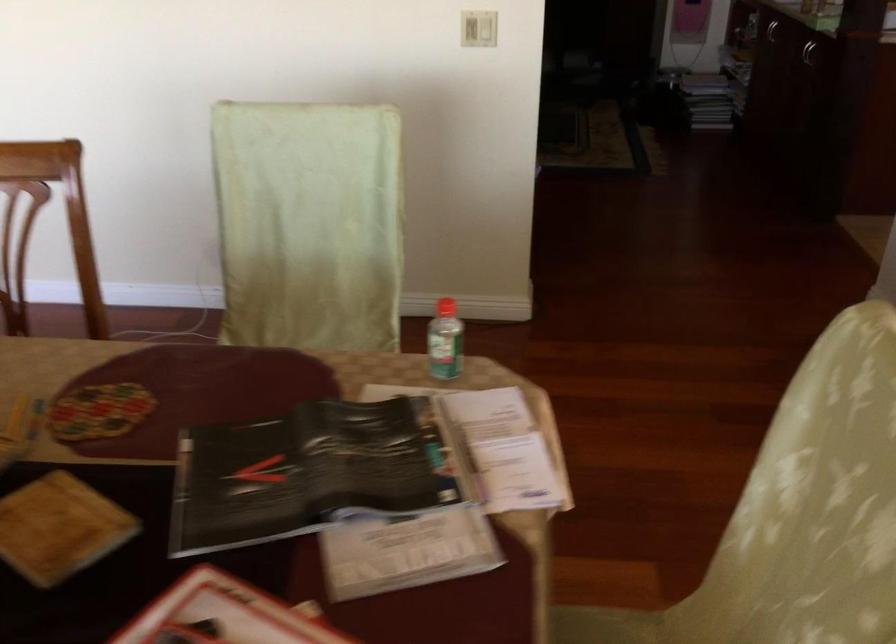
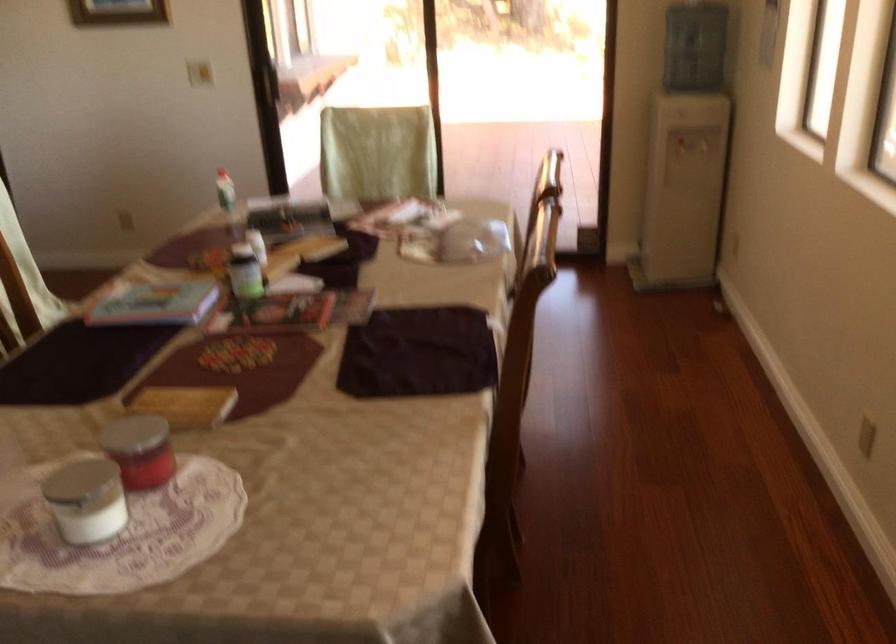
The point at (438, 346) is marked in the first image. Where is the corresponding point in the second image?

(225, 190)